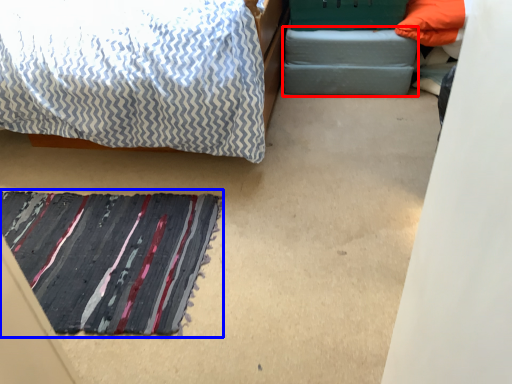
Question: Among these objects, which one is farthest to the camera, footrest (highlighted by a red box) or mat (highlighted by a blue box)?

Choices:
 (A) footrest
 (B) mat

Answer: (A)